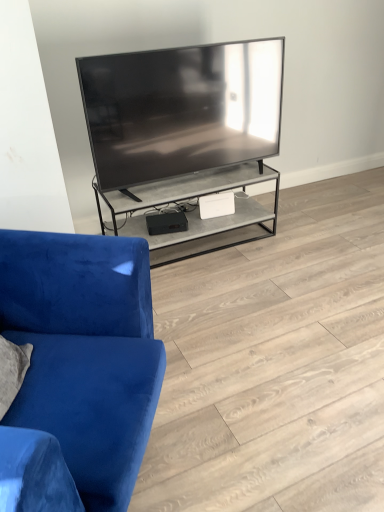
Question: Should I look upward or downward to see blue velvet couch at left?

Choices:
 (A) down
 (B) up

Answer: (A)

Question: Can you confirm if blue velvet couch at left is taller than velvet blue couch at left?

Choices:
 (A) yes
 (B) no

Answer: (B)

Question: Does blue velvet couch at left have a lesser width compared to velvet blue couch at left?

Choices:
 (A) yes
 (B) no

Answer: (B)

Question: Is blue velvet couch at left not close to velvet blue couch at left?

Choices:
 (A) yes
 (B) no

Answer: (B)

Question: Considering the relative positions of blue velvet couch at left and velvet blue couch at left in the image provided, is blue velvet couch at left behind velvet blue couch at left?

Choices:
 (A) yes
 (B) no

Answer: (A)

Question: Is blue velvet couch at left shorter than velvet blue couch at left?

Choices:
 (A) yes
 (B) no

Answer: (A)

Question: Does blue velvet couch at left have a larger size compared to velvet blue couch at left?

Choices:
 (A) yes
 (B) no

Answer: (B)

Question: Is velvet blue couch at left facing towards blue velvet couch at left?

Choices:
 (A) yes
 (B) no

Answer: (B)

Question: Can you confirm if velvet blue couch at left is positioned to the right of blue velvet couch at left?

Choices:
 (A) no
 (B) yes

Answer: (A)

Question: Is velvet blue couch at left looking in the opposite direction of blue velvet couch at left?

Choices:
 (A) yes
 (B) no

Answer: (B)

Question: Can you confirm if velvet blue couch at left is thinner than blue velvet couch at left?

Choices:
 (A) no
 (B) yes

Answer: (B)

Question: Is velvet blue couch at left wider than blue velvet couch at left?

Choices:
 (A) yes
 (B) no

Answer: (B)

Question: Can we say velvet blue couch at left lies outside blue velvet couch at left?

Choices:
 (A) no
 (B) yes

Answer: (B)

Question: Relative to blue velvet couch at left, is velvet blue couch at left in front or behind?

Choices:
 (A) behind
 (B) front

Answer: (B)